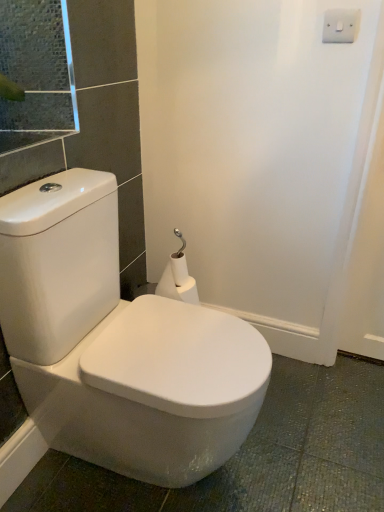
Question: Is white matte toilet paper at center at the right side of white plastic/light switch at upper right?

Choices:
 (A) no
 (B) yes

Answer: (A)

Question: Is white matte toilet paper at center behind white plastic/light switch at upper right?

Choices:
 (A) no
 (B) yes

Answer: (B)

Question: Does white matte toilet paper at center appear on the left side of white plastic/light switch at upper right?

Choices:
 (A) no
 (B) yes

Answer: (B)

Question: From a real-world perspective, is white matte toilet paper at center positioned under white plastic/light switch at upper right based on gravity?

Choices:
 (A) no
 (B) yes

Answer: (B)

Question: From the image's perspective, is white matte toilet paper at center under white plastic/light switch at upper right?

Choices:
 (A) no
 (B) yes

Answer: (B)

Question: Relative to white glossy toilet at center, is white plastic/light switch at upper right in front or behind?

Choices:
 (A) front
 (B) behind

Answer: (B)

Question: Considering the positions of point (327, 13) and point (61, 297), is point (327, 13) closer or farther from the camera than point (61, 297)?

Choices:
 (A) farther
 (B) closer

Answer: (A)

Question: Is white plastic/light switch at upper right bigger or smaller than white glossy toilet at center?

Choices:
 (A) small
 (B) big

Answer: (A)

Question: Considering the relative positions of white plastic/light switch at upper right and white glossy toilet at center in the image provided, is white plastic/light switch at upper right to the left or to the right of white glossy toilet at center?

Choices:
 (A) right
 (B) left

Answer: (A)

Question: In terms of size, does white matte toilet paper at center appear bigger or smaller than white plastic/light switch at upper right?

Choices:
 (A) big
 (B) small

Answer: (A)

Question: In terms of width, does white matte toilet paper at center look wider or thinner when compared to white plastic/light switch at upper right?

Choices:
 (A) thin
 (B) wide

Answer: (B)

Question: Is white matte toilet paper at center situated inside white plastic/light switch at upper right or outside?

Choices:
 (A) inside
 (B) outside

Answer: (B)

Question: Considering the positions of white matte toilet paper at center and white plastic/light switch at upper right in the image, is white matte toilet paper at center taller or shorter than white plastic/light switch at upper right?

Choices:
 (A) short
 (B) tall

Answer: (B)

Question: Is white glossy toilet at center bigger or smaller than white matte toilet paper at center?

Choices:
 (A) small
 (B) big

Answer: (B)

Question: Is point (3, 317) closer or farther from the camera than point (185, 286)?

Choices:
 (A) closer
 (B) farther

Answer: (A)